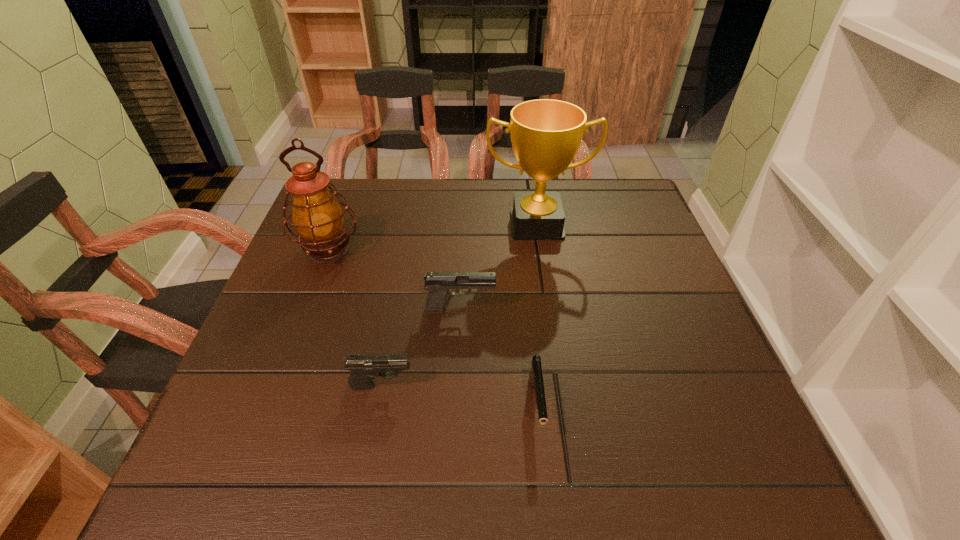
Locate an element on the screen. object that is at the far edge is located at coordinates (546, 134).

The image size is (960, 540). I want to click on object that is at the near edge, so click(535, 377).

Where is `object present at the left edge`? object present at the left edge is located at coordinates (318, 218).

This screenshot has height=540, width=960. I want to click on free space at the far edge of the desktop, so click(x=498, y=217).

Where is `free space at the left edge of the desktop`? The height and width of the screenshot is (540, 960). free space at the left edge of the desktop is located at coordinates (308, 263).

Locate an element on the screen. free location at the right edge is located at coordinates (645, 383).

Find the location of a particular element. This screenshot has height=540, width=960. vacant space at the near left corner of the desktop is located at coordinates (281, 443).

In the image, there is a desktop. In order to click on vacant region at the far right corner in this screenshot , I will do `click(626, 200)`.

The image size is (960, 540). What are the coordinates of `vacant point located between the oil lamp and the second pistol from left to right` in the screenshot? It's located at [395, 280].

Find the location of a particular element. The image size is (960, 540). vacant area between the award and the rightmost pistol is located at coordinates (537, 316).